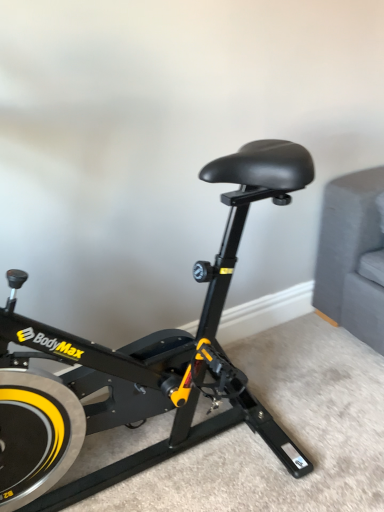
Image resolution: width=384 pixels, height=512 pixels. What are the coordinates of `blank area beneath black matte stationary bicycle at center (from a real-world perspective)` in the screenshot? It's located at (182, 461).